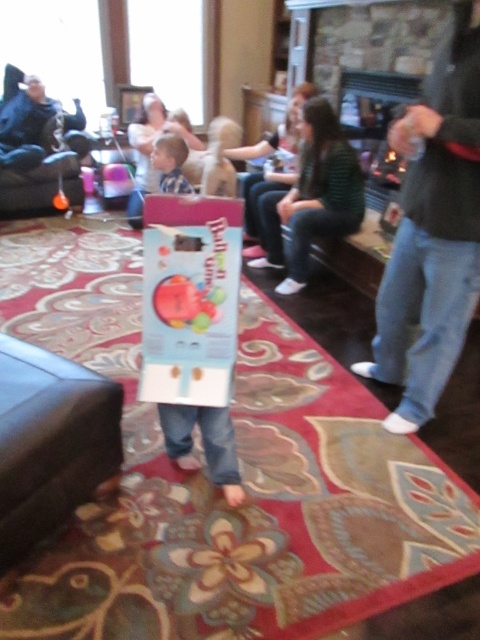
Question: Which of the following is the farthest from the observer?

Choices:
 (A) (162, 138)
 (B) (460, 61)

Answer: (A)

Question: Can you confirm if jeans at center is positioned above light brown hair at center?

Choices:
 (A) yes
 (B) no

Answer: (B)

Question: Is jeans at center wider than light brown hair at center?

Choices:
 (A) yes
 (B) no

Answer: (A)

Question: Which point is closer to the camera taking this photo?

Choices:
 (A) (157, 147)
 (B) (451, 252)

Answer: (B)

Question: Can you confirm if jeans at center is positioned to the left of light brown hair at center?

Choices:
 (A) no
 (B) yes

Answer: (A)